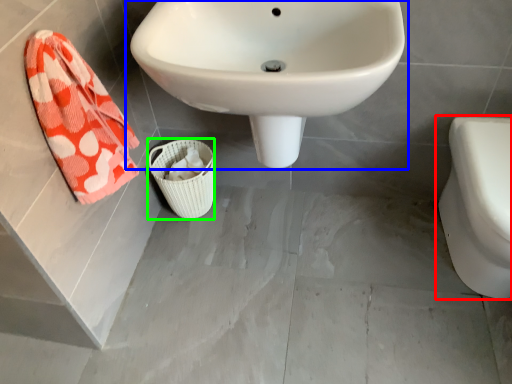
Question: Considering the real-world distances, which object is farthest from toilet (highlighted by a red box)? sink (highlighted by a blue box) or basket (highlighted by a green box)?

Choices:
 (A) sink
 (B) basket

Answer: (B)